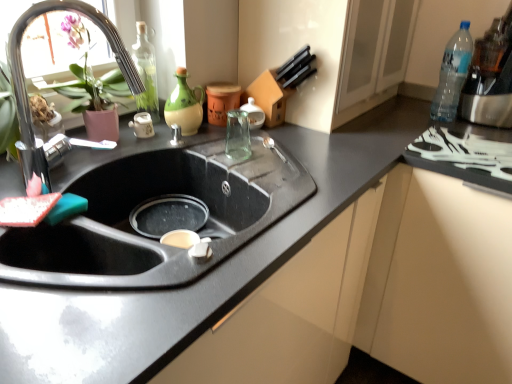
Locate an element on the screen. empty space that is to the right of green matte jug at upper center, placed as the 2th bottle when sorted from right to left is located at coordinates (233, 139).